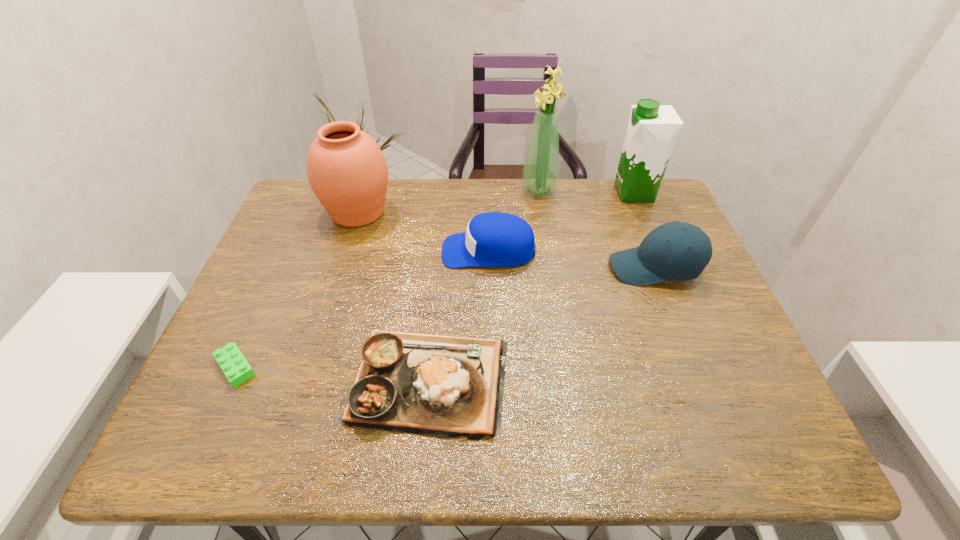
Where is `vacant space located 0.380m on the front-facing side of the fifth tallest object`? This screenshot has width=960, height=540. vacant space located 0.380m on the front-facing side of the fifth tallest object is located at coordinates (303, 251).

At what (x,y) coordinates should I click in order to perform the action: click on free space located 0.340m on the front-facing side of the fifth tallest object. Please return your answer as a coordinate pair (x, y). This screenshot has height=540, width=960. Looking at the image, I should click on (318, 251).

This screenshot has width=960, height=540. I want to click on free spot located 0.230m on the back of the platter, so click(x=438, y=262).

The image size is (960, 540). I want to click on free space located on the front of the shortest object, so click(x=204, y=440).

Where is `bouquet situated at the far edge`? This screenshot has height=540, width=960. bouquet situated at the far edge is located at coordinates (540, 171).

The width and height of the screenshot is (960, 540). What are the coordinates of `soya milk at the far edge` in the screenshot? It's located at (652, 130).

Locate an element on the screen. urn that is at the far edge is located at coordinates (347, 171).

You are a GUI agent. You are given a task and a screenshot of the screen. Output one action in this format:
    pyautogui.click(x=<x>, y=<y>)
    Task: Click on the object positioned at the near edge
    This screenshot has width=960, height=540.
    Given the screenshot: What is the action you would take?
    pyautogui.click(x=415, y=383)

Find the location of a particular element. The width and height of the screenshot is (960, 540). urn located in the left edge section of the desktop is located at coordinates (347, 171).

Where is `Lego positioned at the left edge`? This screenshot has height=540, width=960. Lego positioned at the left edge is located at coordinates (234, 365).